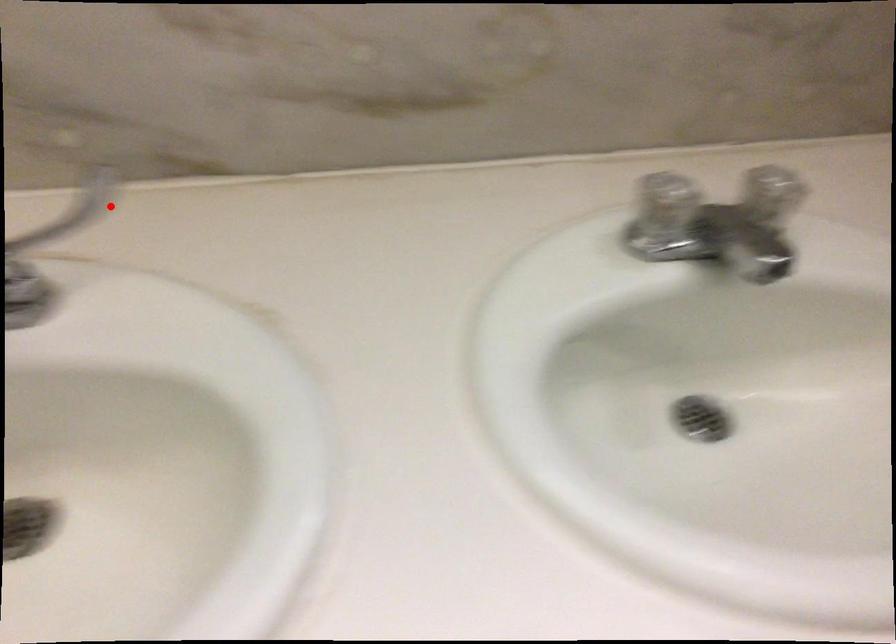
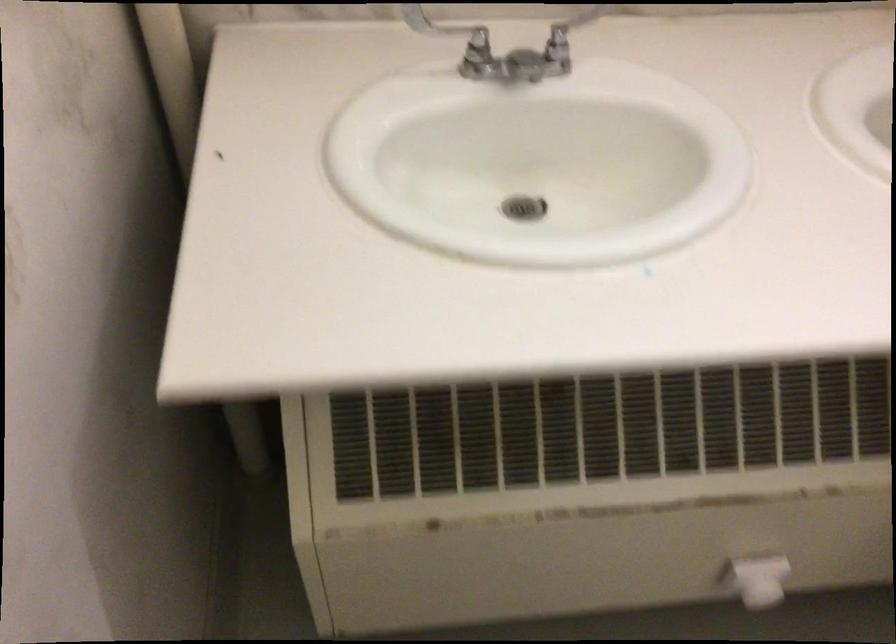
Question: I am providing you with two images of the same scene from different viewpoints. Given a red point in image1, look at the same physical point in image2. Is it:

Choices:
 (A) Closer to the viewpoint
 (B) Farther from the viewpoint

Answer: (B)